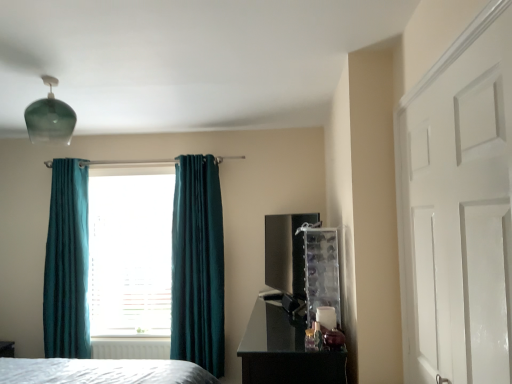
I want to click on blank space above white plastic radiator at lower center (from a real-world perspective), so [x=126, y=339].